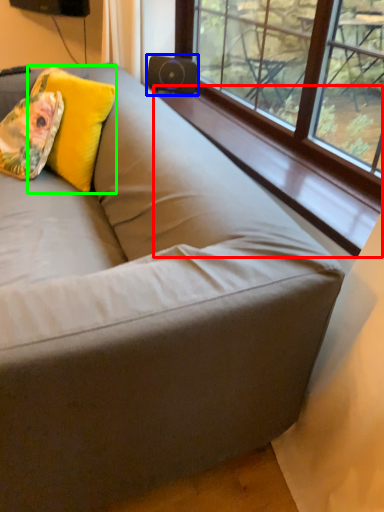
Question: Estimate the real-world distances between objects in this image. Which object is farther from window sill (highlighted by a red box), speaker (highlighted by a blue box) or throw pillow (highlighted by a green box)?

Choices:
 (A) speaker
 (B) throw pillow

Answer: (B)